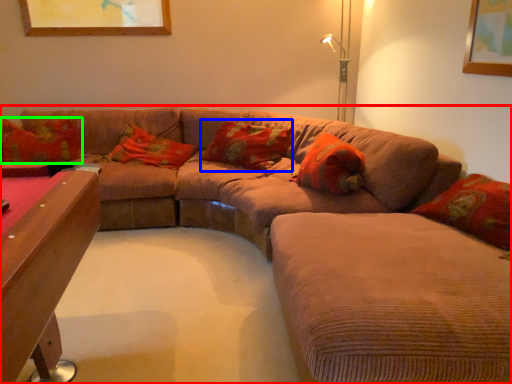
Question: Estimate the real-world distances between objects in this image. Which object is closer to studio couch (highlighted by a red box), pillow (highlighted by a blue box) or pillow (highlighted by a green box)?

Choices:
 (A) pillow
 (B) pillow

Answer: (A)